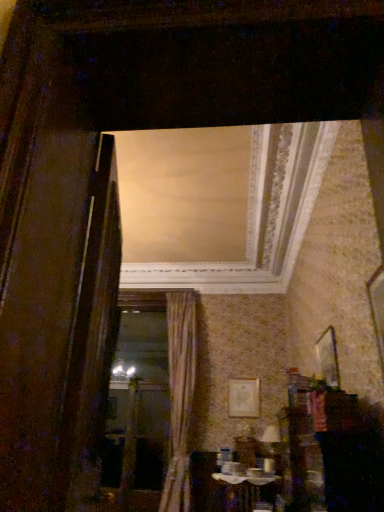
You are a GUI agent. You are given a task and a screenshot of the screen. Output one action in this format:
    pyautogui.click(x=<x>, y=<y>)
    Task: Click on the wooden table at lower center
    Image resolution: width=384 pixels, height=512 pixels.
    Given the screenshot: What is the action you would take?
    pyautogui.click(x=245, y=490)

Locate an element on the screen. wooden picture frame at upper right, the first picture frame when ordered from front to back is located at coordinates (328, 358).

From the picture: What is the approximate width of wooden frame at center?

The width of wooden frame at center is 2.73 inches.

The height and width of the screenshot is (512, 384). Find the location of `wooden table at lower center`. wooden table at lower center is located at coordinates (245, 490).

Is wooden table at lower center to the left or to the right of matte gold picture frame at center, marked as the first picture frame in a left-to-right arrangement, in the image?

wooden table at lower center is to the left of matte gold picture frame at center, marked as the first picture frame in a left-to-right arrangement.

This screenshot has height=512, width=384. What are the coordinates of `table in front of the matte gold picture frame at center, the 2th picture frame viewed from the front` in the screenshot? It's located at (245, 490).

Is wooden table at lower center oriented towards matte gold picture frame at center, the 2th picture frame viewed from the front?

No, wooden table at lower center is not aimed at matte gold picture frame at center, the 2th picture frame viewed from the front.

Which of these two, wooden table at lower center or matte gold picture frame at center, marked as the first picture frame in a left-to-right arrangement, is wider?

wooden table at lower center is wider.

Consider the image. Considering the sizes of objects wooden picture frame at upper right, the first picture frame when ordered from front to back, and gold textured curtain at center in the image provided, who is bigger, wooden picture frame at upper right, the first picture frame when ordered from front to back, or gold textured curtain at center?

gold textured curtain at center.

From their relative heights in the image, would you say wooden picture frame at upper right, which ranks as the 2th picture frame in left-to-right order, is taller or shorter than gold textured curtain at center?

Clearly, wooden picture frame at upper right, which ranks as the 2th picture frame in left-to-right order, is shorter compared to gold textured curtain at center.

Visually, is wooden picture frame at upper right, which ranks as the 2th picture frame in left-to-right order, positioned to the left or to the right of gold textured curtain at center?

In the image, wooden picture frame at upper right, which ranks as the 2th picture frame in left-to-right order, appears on the right side of gold textured curtain at center.

Is wooden picture frame at upper right, which ranks as the 2th picture frame in left-to-right order, positioned with its back to gold textured curtain at center?

No, wooden picture frame at upper right, which ranks as the 2th picture frame in left-to-right order,'s orientation is not away from gold textured curtain at center.

You are a GUI agent. You are given a task and a screenshot of the screen. Output one action in this format:
    pyautogui.click(x=<x>, y=<y>)
    Task: Click on the window frame above the wooden table at lower center (from a real-world perspective)
    The width and height of the screenshot is (384, 512).
    Given the screenshot: What is the action you would take?
    pyautogui.click(x=138, y=403)

Which point is more forward, (142,402) or (250,494)?

The point (142,402) is closer to the camera.

Is wooden frame at center oriented away from wooden table at lower center?

No, wooden table at lower center is not at the back of wooden frame at center.

From the image's perspective, would you say wooden frame at center is shown under wooden table at lower center?

Yes, from the image's perspective, wooden frame at center is below wooden table at lower center.

Consider the image. Considering the relative sizes of wooden frame at center and matte gold picture frame at center, which ranks as the first picture frame in bottom-to-top order, in the image provided, is wooden frame at center thinner than matte gold picture frame at center, which ranks as the first picture frame in bottom-to-top order,?

No.

From the picture: Is the depth of wooden frame at center greater than that of matte gold picture frame at center, the 2th picture frame viewed from the front?

No.

From their relative heights in the image, would you say wooden frame at center is taller or shorter than matte gold picture frame at center, which is the first picture frame in back-to-front order?

Considering their sizes, wooden frame at center has more height than matte gold picture frame at center, which is the first picture frame in back-to-front order.

From the image's perspective, is wooden frame at center on top of matte gold picture frame at center, which is the 2th picture frame in top-to-bottom order?

No.

From a real-world perspective, who is located lower, wooden frame at center or wooden picture frame at upper right, which ranks as the 2th picture frame in left-to-right order?

wooden frame at center is physically lower.

Is wooden frame at center bigger than wooden picture frame at upper right, which ranks as the 1th picture frame in top-to-bottom order?

Correct, wooden frame at center is larger in size than wooden picture frame at upper right, which ranks as the 1th picture frame in top-to-bottom order.

Can you confirm if wooden frame at center is thinner than wooden picture frame at upper right, which ranks as the 2th picture frame in left-to-right order?

No.

Would you consider wooden table at lower center to be distant from gold textured curtain at center?

That's not correct — wooden table at lower center is a little close to gold textured curtain at center.

Which of these two, wooden table at lower center or gold textured curtain at center, stands shorter?

Standing shorter between the two is wooden table at lower center.

Is wooden table at lower center not within gold textured curtain at center?

Yes.

Is wooden picture frame at upper right, which is the second picture frame from bottom to top, behind wooden frame at center?

No, wooden picture frame at upper right, which is the second picture frame from bottom to top, is in front of wooden frame at center.

From a real-world perspective, is wooden picture frame at upper right, marked as the 2th picture frame in a back-to-front arrangement, above or below wooden frame at center?

wooden picture frame at upper right, marked as the 2th picture frame in a back-to-front arrangement, is above wooden frame at center.

Is wooden picture frame at upper right, marked as the 1th picture frame in a right-to-left arrangement, not within wooden frame at center?

Absolutely, wooden picture frame at upper right, marked as the 1th picture frame in a right-to-left arrangement, is external to wooden frame at center.

From the wooden table at lower center, count 1st picture frame to the right and point to it. Please provide its 2D coordinates.

[(244, 398)]

The width and height of the screenshot is (384, 512). I want to click on curtain lying on the left of wooden picture frame at upper right, marked as the 2th picture frame in a back-to-front arrangement, so click(180, 397).

Which object lies further to the anchor point gold textured curtain at center, wooden picture frame at upper right, which ranks as the 1th picture frame in top-to-bottom order, or matte gold picture frame at center, the 2th picture frame viewed from the front?

Among the two, wooden picture frame at upper right, which ranks as the 1th picture frame in top-to-bottom order, is located further to gold textured curtain at center.

Based on their spatial positions, is matte gold picture frame at center, the second picture frame positioned from the right, or wooden frame at center closer to wooden picture frame at upper right, marked as the 1th picture frame in a right-to-left arrangement?

matte gold picture frame at center, the second picture frame positioned from the right, is positioned closer to the anchor wooden picture frame at upper right, marked as the 1th picture frame in a right-to-left arrangement.

Which object lies nearer to the anchor point wooden frame at center, gold textured curtain at center or matte gold picture frame at center, the second picture frame positioned from the right?

The object closer to wooden frame at center is gold textured curtain at center.

From the image, which object appears to be farther from wooden frame at center, matte gold picture frame at center, which is the first picture frame in back-to-front order, or wooden picture frame at upper right, marked as the 2th picture frame in a back-to-front arrangement?

wooden picture frame at upper right, marked as the 2th picture frame in a back-to-front arrangement, lies further to wooden frame at center than the other object.

Which object lies nearer to the anchor point wooden picture frame at upper right, the first picture frame when ordered from front to back, gold textured curtain at center or matte gold picture frame at center, which ranks as the first picture frame in bottom-to-top order?

Among the two, matte gold picture frame at center, which ranks as the first picture frame in bottom-to-top order, is located nearer to wooden picture frame at upper right, the first picture frame when ordered from front to back.

Looking at the image, which one is located closer to matte gold picture frame at center, marked as the first picture frame in a left-to-right arrangement, wooden frame at center or wooden picture frame at upper right, which ranks as the 2th picture frame in left-to-right order?

wooden picture frame at upper right, which ranks as the 2th picture frame in left-to-right order, is closer to matte gold picture frame at center, marked as the first picture frame in a left-to-right arrangement.

From the image, which object appears to be nearer to matte gold picture frame at center, which is the first picture frame in back-to-front order, wooden frame at center or gold textured curtain at center?

gold textured curtain at center is positioned closer to the anchor matte gold picture frame at center, which is the first picture frame in back-to-front order.

When comparing their distances from wooden table at lower center, does matte gold picture frame at center, marked as the first picture frame in a left-to-right arrangement, or gold textured curtain at center seem closer?

The object closer to wooden table at lower center is matte gold picture frame at center, marked as the first picture frame in a left-to-right arrangement.

Where is `table between wooden picture frame at upper right, which ranks as the 1th picture frame in top-to-bottom order, and matte gold picture frame at center, the 2th picture frame viewed from the front, from front to back`? This screenshot has width=384, height=512. table between wooden picture frame at upper right, which ranks as the 1th picture frame in top-to-bottom order, and matte gold picture frame at center, the 2th picture frame viewed from the front, from front to back is located at coordinates (245, 490).

I want to click on table positioned between wooden picture frame at upper right, marked as the 2th picture frame in a back-to-front arrangement, and gold textured curtain at center from near to far, so click(x=245, y=490).

Find the location of a particular element. window frame positioned between wooden picture frame at upper right, marked as the 1th picture frame in a right-to-left arrangement, and matte gold picture frame at center, marked as the first picture frame in a left-to-right arrangement, from near to far is located at coordinates (138, 403).

The image size is (384, 512). Identify the location of curtain between wooden picture frame at upper right, marked as the 1th picture frame in a right-to-left arrangement, and wooden frame at center in the front-back direction. (180, 397).